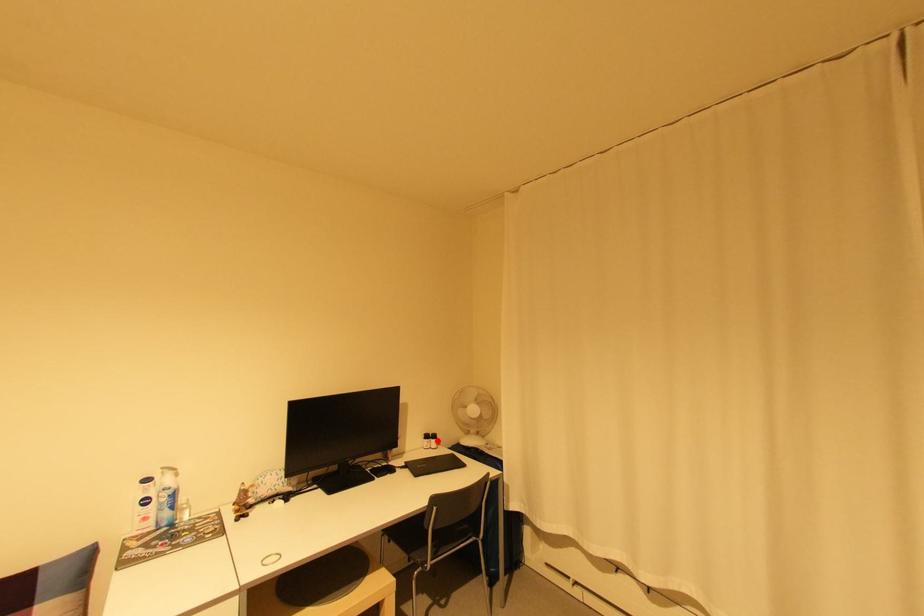
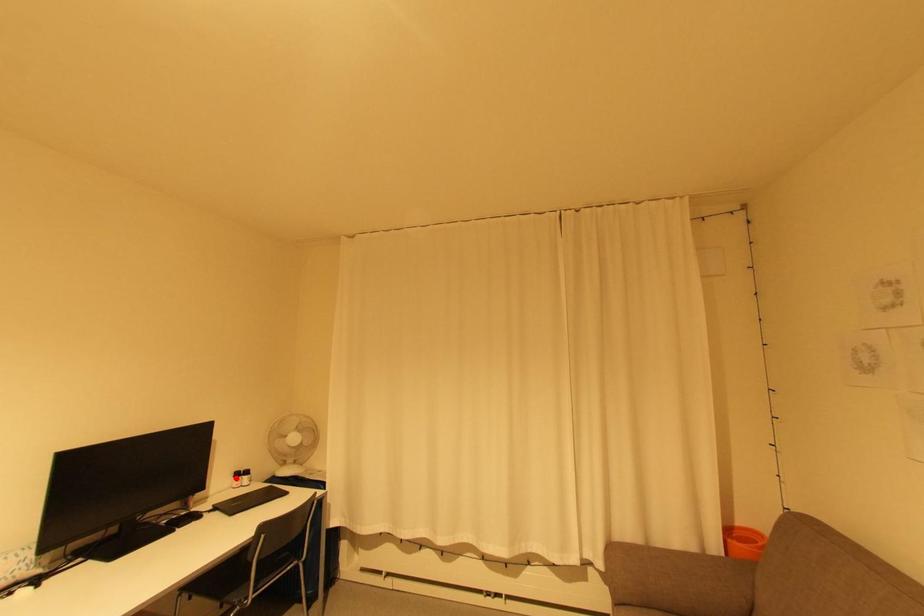
I am providing you with two images of the same scene from different viewpoints. A red point is marked on the first image and another point is marked on the second image. Is the red point in image1 aligned with the point shown in image2?

No